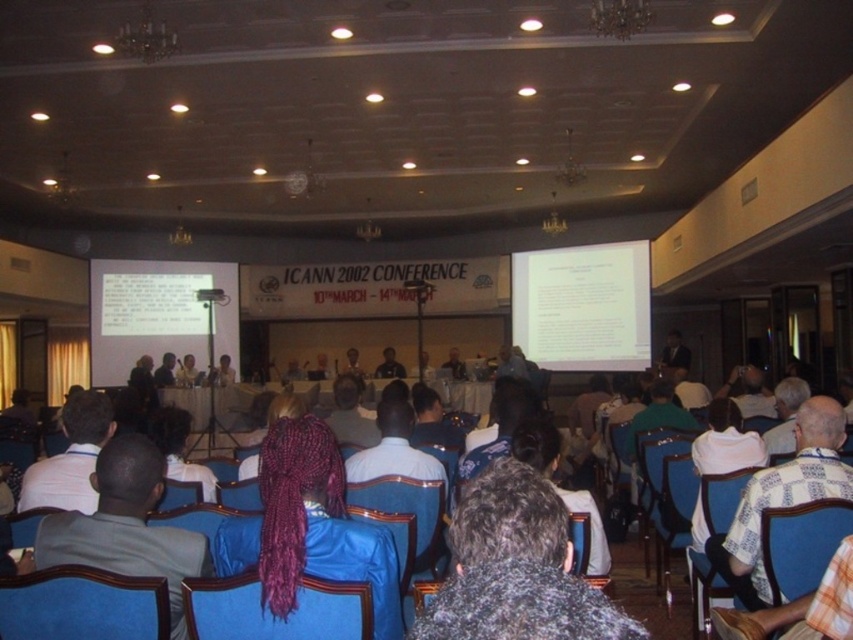
Question: Which of the following is the closest to the observer?

Choices:
 (A) white paper at center
 (B) dark gray sweater at center

Answer: (B)

Question: Which point appears farthest from the camera in this image?

Choices:
 (A) (328, 513)
 (B) (71, 582)
 (C) (189, 422)

Answer: (C)

Question: Does blue fabric chair at lower left appear on the left side of blue fabric chair at center?

Choices:
 (A) yes
 (B) no

Answer: (A)

Question: Estimate the real-world distances between objects in this image. Which object is farther from the dark purple braided hair at center?

Choices:
 (A) white paper at center
 (B) dark gray sweater at center

Answer: (A)

Question: Can you confirm if dark gray sweater at center is positioned below blue fabric chair at lower left?

Choices:
 (A) no
 (B) yes

Answer: (A)

Question: From the image, what is the correct spatial relationship of dark purple braided hair at center in relation to blue fabric chair at center?

Choices:
 (A) above
 (B) below

Answer: (A)